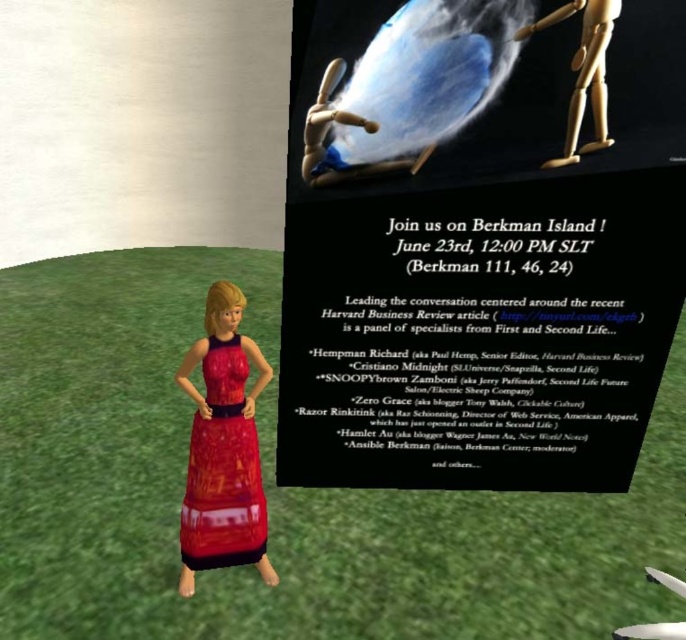
You are a character in the virtual world and want to move from the shiny red dress at lower left to the wooden figure at upper right. Which direction should you move?

The shiny red dress at lower left is located below the wooden figure at upper right, so you should move upward to reach the wooden figure at upper right.

Consider the image. You are a photographer trying to capture both the shiny red dress at lower left and the wooden figure at upper right in the same frame. Which object should you focus on first to ensure both are in focus?

You should focus on the wooden figure at upper right first because it is farther away from the viewer than the shiny red dress at lower left. By focusing on the farther object, the closer object will also be in focus due to the depth of field.